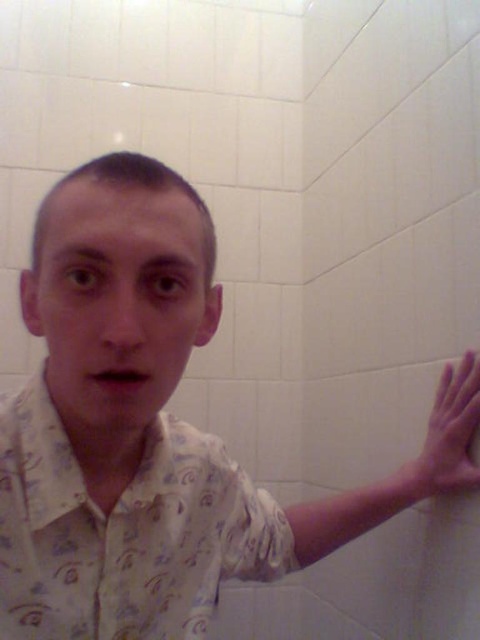
Which is more to the right, white printed shirt at center or pink flesh-toned hand at right?

pink flesh-toned hand at right

Which is above, white printed shirt at center or pink flesh-toned hand at right?

Positioned higher is pink flesh-toned hand at right.

Find the location of a particular element. This screenshot has height=640, width=480. white printed shirt at center is located at coordinates (124, 532).